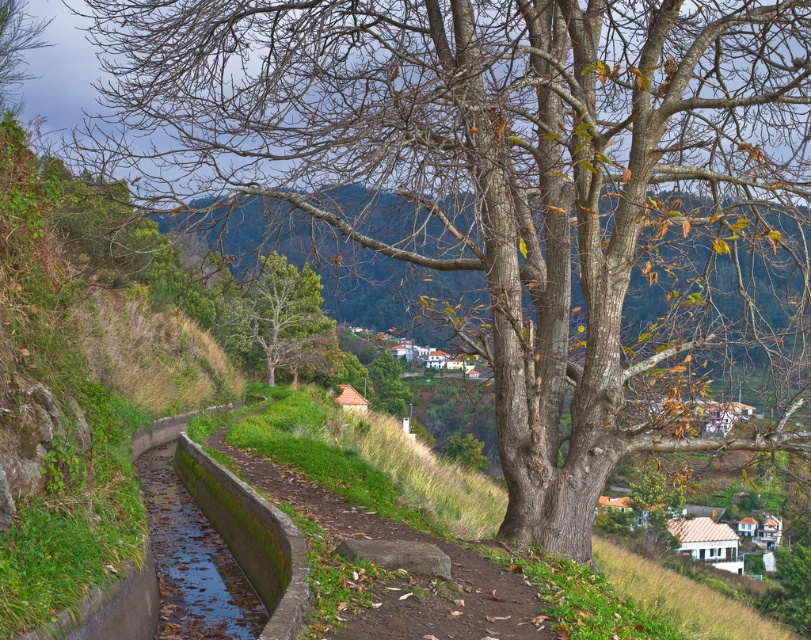
Question: Can you confirm if green leafy tree at center is thinner than brown matte tree at upper left?

Choices:
 (A) no
 (B) yes

Answer: (A)

Question: Among these objects, which one is farthest from the camera?

Choices:
 (A) green leafy tree at center
 (B) brown matte tree at upper left

Answer: (B)

Question: Which of the following is the farthest from the observer?

Choices:
 (A) green mossy concrete at center
 (B) green leafy tree at center

Answer: (B)

Question: In this image, where is green mossy concrete at center located relative to brown matte tree at upper left?

Choices:
 (A) above
 (B) below

Answer: (B)

Question: Does green mossy concrete at center lie in front of brown matte tree at upper left?

Choices:
 (A) yes
 (B) no

Answer: (A)

Question: Which object is closer to the camera taking this photo?

Choices:
 (A) green mossy concrete at center
 (B) brown matte tree at upper left

Answer: (A)